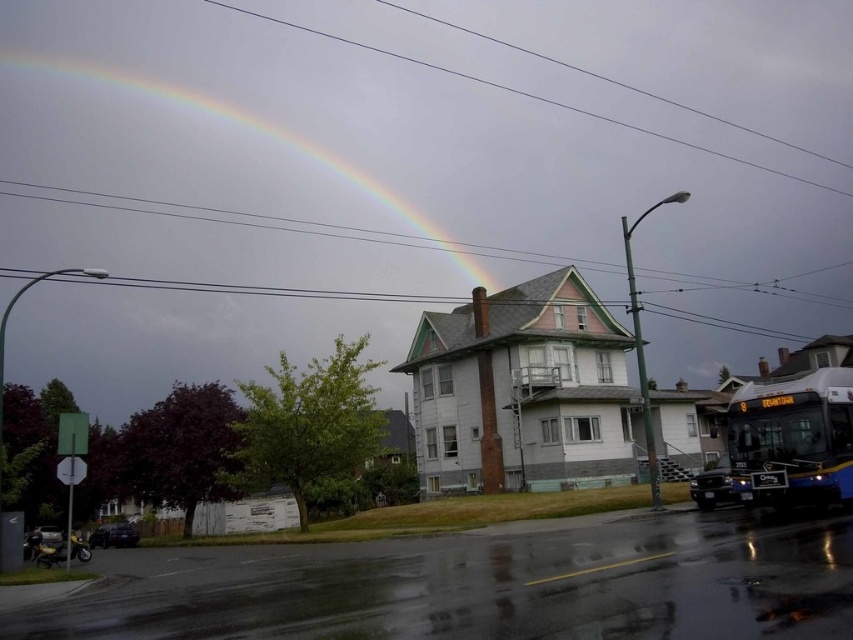
Question: Can you confirm if blue metallic bus at lower right is wider than rainbow at upper left?

Choices:
 (A) no
 (B) yes

Answer: (A)

Question: Can you confirm if blue metallic bus at lower right is bigger than rainbow at upper left?

Choices:
 (A) no
 (B) yes

Answer: (A)

Question: Does blue metallic bus at lower right appear over rainbow at upper left?

Choices:
 (A) yes
 (B) no

Answer: (B)

Question: Which of the following is the closest to the observer?

Choices:
 (A) (730, 468)
 (B) (207, 113)

Answer: (A)

Question: Among these points, which one is farthest from the camera?

Choices:
 (A) (428, 218)
 (B) (830, 426)

Answer: (A)